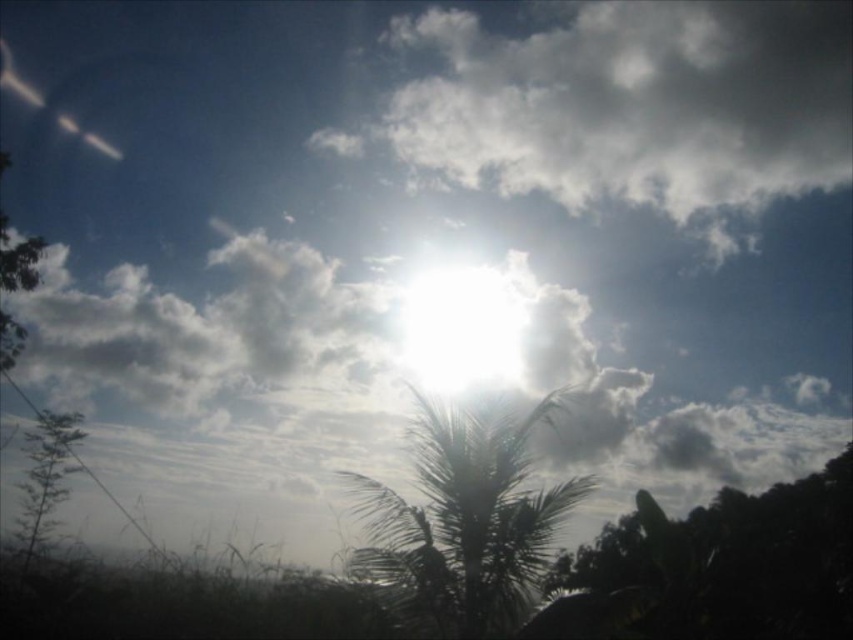
Question: Which object appears closest to the camera in this image?

Choices:
 (A) silhouette leafy palm at center
 (B) green leafy plant at lower left
 (C) green leafy tree at lower right

Answer: (C)

Question: From the image, what is the correct spatial relationship of green leafy tree at lower right in relation to silhouette leafy palm at center?

Choices:
 (A) below
 (B) above

Answer: (A)

Question: Can you confirm if green leafy tree at lower right is thinner than green leafy plant at lower left?

Choices:
 (A) yes
 (B) no

Answer: (B)

Question: Does silhouette leafy palm at center appear over bright white sun at center?

Choices:
 (A) no
 (B) yes

Answer: (A)

Question: Which object is farther from the camera taking this photo?

Choices:
 (A) bright white sun at center
 (B) green leafy tree at lower right

Answer: (A)

Question: Estimate the real-world distances between objects in this image. Which object is farther from the green leafy tree at lower right?

Choices:
 (A) bright white sun at center
 (B) green leafy plant at lower left
 (C) silhouette leafy palm at center

Answer: (B)